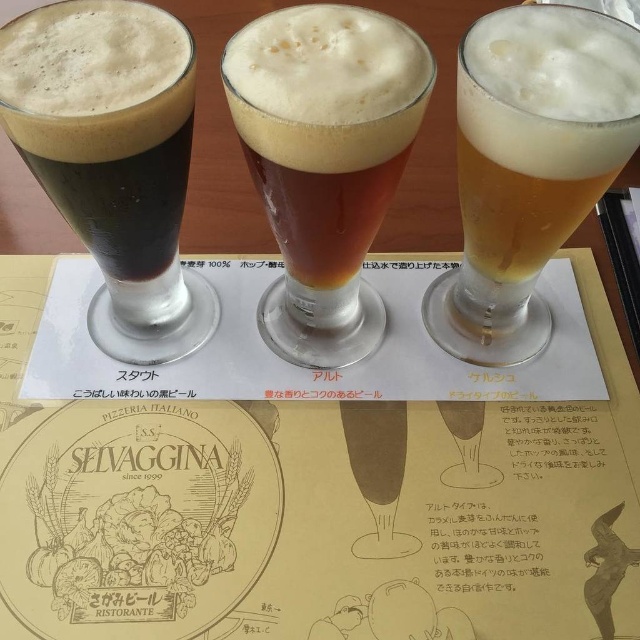
You are a bartender trying to place a coaster exactly between the dark brown glass at left and the golden frothy beer at right. Given their widths, which glass requires a wider coaster to cover its base?

The dark brown glass at left requires a wider coaster because its width is larger than the golden frothy beer at right.

You are a barista who needs to place a 8.5 inch wide menu between the matte paper menu at center and the dark brown glass at left. Can you fit it there?

The distance between the matte paper menu at center and the dark brown glass at left is 8.46 inches. Since the menu is 8.5 inches wide, it is slightly too wide to fit in the space between them.

You are a bartender who needs to stack these glasses vertically in a cabinet. Given that the cabinet has a height limit of 30 cm, and the dark brown glass at left is 25 cm tall while the golden frothy beer at right is 28 cm tall, will both glasses fit individually without exceeding the height limit?

The dark brown glass at left is 25 cm tall and the golden frothy beer at right is 28 cm tall. Both are under the 30 cm height limit, so they can fit individually in the cabinet.